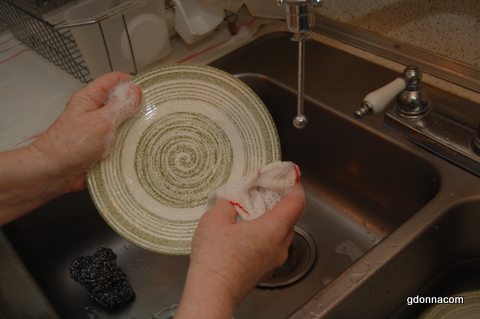
The width and height of the screenshot is (480, 319). I want to click on dish scrubber, so click(x=103, y=288).